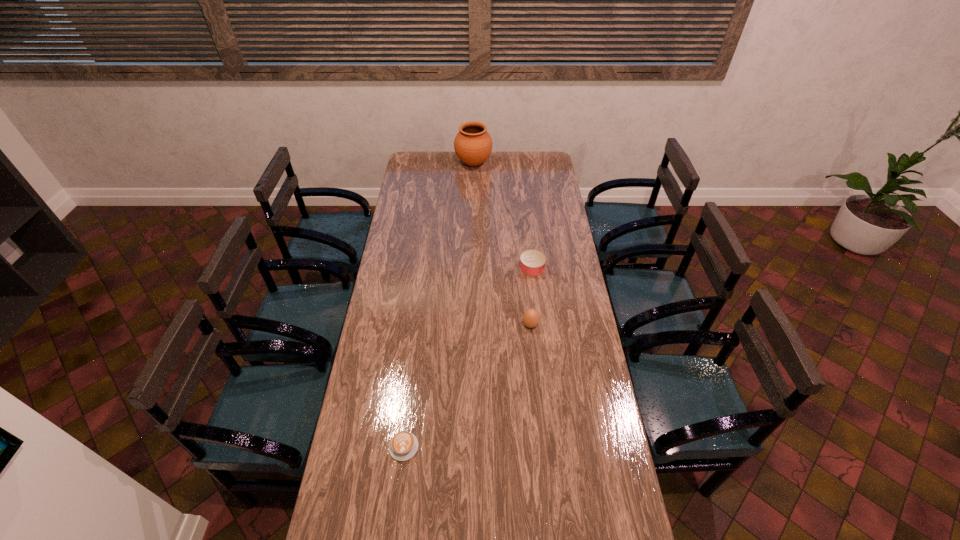
In the image, there is a desktop. Where is `blank space at the far left corner`? blank space at the far left corner is located at coordinates (407, 167).

What are the coordinates of `vacant area that lies between the cappuccino and the third nearest object` in the screenshot? It's located at (468, 357).

You are a GUI agent. You are given a task and a screenshot of the screen. Output one action in this format:
    pyautogui.click(x=<x>, y=<y>)
    Task: Click on the vacant space in between the leftmost object and the second shortest object
    The height and width of the screenshot is (540, 960).
    Given the screenshot: What is the action you would take?
    click(468, 357)

Where is `empty space between the farthest object and the third shortest object`? This screenshot has height=540, width=960. empty space between the farthest object and the third shortest object is located at coordinates (502, 244).

Find the location of `vacant area that lies between the shortest object and the farthest object`. vacant area that lies between the shortest object and the farthest object is located at coordinates (439, 305).

Locate an element on the screen. This screenshot has height=540, width=960. vacant space that's between the second shortest object and the pottery is located at coordinates (503, 215).

Locate an element on the screen. Image resolution: width=960 pixels, height=540 pixels. the closest object relative to the third nearest object is located at coordinates (530, 318).

Identify which object is the third closest to the boiled egg. Please provide its 2D coordinates. Your answer should be formatted as a tuple, i.e. [(x, y)], where the tuple contains the x and y coordinates of a point satisfying the conditions above.

[(473, 144)]

You are a GUI agent. You are given a task and a screenshot of the screen. Output one action in this format:
    pyautogui.click(x=<x>, y=<y>)
    Task: Click on the free point that satisfies the following two spatial constraints: 1. on the side of the nearest object with the handle; 2. on the right side of the farthest object
    
    Given the screenshot: What is the action you would take?
    pyautogui.click(x=439, y=163)

Locate an element on the screen. This screenshot has width=960, height=540. vacant space that satisfies the following two spatial constraints: 1. on the side of the third farthest object with the handle; 2. on the right side of the cappuccino is located at coordinates (419, 325).